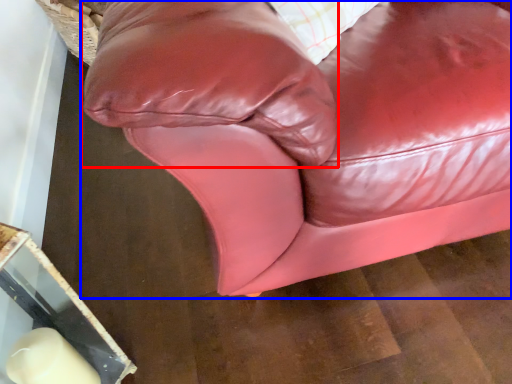
Question: Which object is further to the camera taking this photo, pillow (highlighted by a red box) or studio couch (highlighted by a blue box)?

Choices:
 (A) pillow
 (B) studio couch

Answer: (B)